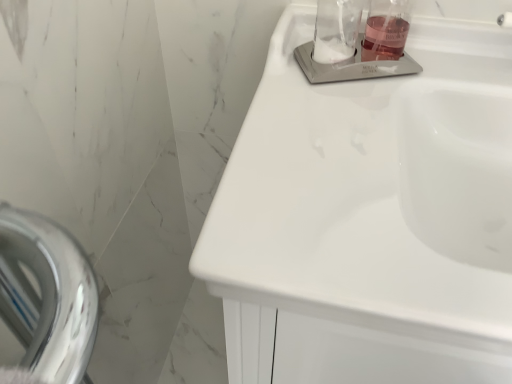
What do you see at coordinates (336, 30) in the screenshot? I see `clear glass jar at upper center` at bounding box center [336, 30].

Find the location of a particular element. clear glass soap dispenser at upper right, positioned as the second sink in front-to-back order is located at coordinates (352, 65).

Consider the image. From the image's perspective, who appears lower, translucent glass liquid at upper right or white glossy sink at upper right, acting as the 1th sink starting from the front?

From the image's view, white glossy sink at upper right, acting as the 1th sink starting from the front, is below.

Is translucent glass liquid at upper right to the left of white glossy sink at upper right, which is counted as the second sink, starting from the back, from the viewer's perspective?

Correct, you'll find translucent glass liquid at upper right to the left of white glossy sink at upper right, which is counted as the second sink, starting from the back.

Does point (399, 50) lie in front of point (401, 83)?

No.

Would you say translucent glass liquid at upper right is inside or outside white glossy sink at upper right, which is counted as the second sink, starting from the back?

translucent glass liquid at upper right exists outside the volume of white glossy sink at upper right, which is counted as the second sink, starting from the back.

Is translucent glass liquid at upper right surrounded by clear glass soap dispenser at upper right, which is the first sink in back-to-front order?

That's incorrect, translucent glass liquid at upper right is not inside clear glass soap dispenser at upper right, which is the first sink in back-to-front order.

Could you measure the distance between clear glass soap dispenser at upper right, the first sink in the top-to-bottom sequence, and translucent glass liquid at upper right?

clear glass soap dispenser at upper right, the first sink in the top-to-bottom sequence, is 2.35 inches away from translucent glass liquid at upper right.

From the image's perspective, starting from the translucent glass liquid at upper right, which sink is the 1st one below? Please provide its 2D coordinates.

[(352, 65)]

Which object is positioned more to the left, clear glass soap dispenser at upper right, the first sink in the top-to-bottom sequence, or translucent glass liquid at upper right?

clear glass soap dispenser at upper right, the first sink in the top-to-bottom sequence.

Does white glossy sink at upper right, marked as the second sink in a top-to-bottom arrangement, touch clear glass soap dispenser at upper right, which is the first sink in back-to-front order?

No, white glossy sink at upper right, marked as the second sink in a top-to-bottom arrangement, is not making contact with clear glass soap dispenser at upper right, which is the first sink in back-to-front order.

Is white glossy sink at upper right, acting as the 1th sink starting from the front, positioned with its back to clear glass soap dispenser at upper right, positioned as the second sink in front-to-back order?

white glossy sink at upper right, acting as the 1th sink starting from the front, does not have its back to clear glass soap dispenser at upper right, positioned as the second sink in front-to-back order.

Does white glossy sink at upper right, the 1th sink when ordered from bottom to top, lie behind clear glass soap dispenser at upper right, the first sink in the top-to-bottom sequence?

That is False.

Is white glossy sink at upper right, the 1th sink when ordered from bottom to top, inside or outside of clear glass soap dispenser at upper right, the first sink in the top-to-bottom sequence?

white glossy sink at upper right, the 1th sink when ordered from bottom to top, is spatially situated outside clear glass soap dispenser at upper right, the first sink in the top-to-bottom sequence.

How different are the orientations of white glossy sink at upper right, the 1th sink when ordered from bottom to top, and translucent glass liquid at upper right in degrees?

The angle between the facing direction of white glossy sink at upper right, the 1th sink when ordered from bottom to top, and the facing direction of translucent glass liquid at upper right is 24 degrees.

Is translucent glass liquid at upper right completely or partially inside white glossy sink at upper right, acting as the 1th sink starting from the front?

No.

Does point (474, 204) come closer to viewer compared to point (387, 45)?

Yes, point (474, 204) is in front of point (387, 45).

From the picture: Which object is closer to the camera, white glossy sink at upper right, acting as the 1th sink starting from the front, or translucent glass liquid at upper right?

white glossy sink at upper right, acting as the 1th sink starting from the front, is closer to the camera.

How different are the orientations of clear glass jar at upper center and clear glass soap dispenser at upper right, the first sink in the top-to-bottom sequence, in degrees?

0.002 degrees separate the facing orientations of clear glass jar at upper center and clear glass soap dispenser at upper right, the first sink in the top-to-bottom sequence.

Who is more distant, clear glass jar at upper center or clear glass soap dispenser at upper right, which is the first sink in back-to-front order?

clear glass soap dispenser at upper right, which is the first sink in back-to-front order, is further away from the camera.

Is clear glass jar at upper center to the left of clear glass soap dispenser at upper right, the first sink in the top-to-bottom sequence, from the viewer's perspective?

Indeed, clear glass jar at upper center is positioned on the left side of clear glass soap dispenser at upper right, the first sink in the top-to-bottom sequence.

From the image's perspective, relative to clear glass soap dispenser at upper right, positioned as the second sink in front-to-back order, is clear glass jar at upper center above or below?

Based on their image positions, clear glass jar at upper center is located above clear glass soap dispenser at upper right, positioned as the second sink in front-to-back order.

From the image's perspective, which is above, translucent glass liquid at upper right or clear glass soap dispenser at upper right, the first sink in the top-to-bottom sequence?

translucent glass liquid at upper right.

Does translucent glass liquid at upper right turn towards clear glass soap dispenser at upper right, the 2th sink ordered from the bottom?

No, translucent glass liquid at upper right is not facing towards clear glass soap dispenser at upper right, the 2th sink ordered from the bottom.

In the scene shown: Could you measure the distance between translucent glass liquid at upper right and clear glass soap dispenser at upper right, positioned as the second sink in front-to-back order?

translucent glass liquid at upper right is 2.35 inches away from clear glass soap dispenser at upper right, positioned as the second sink in front-to-back order.

Considering the relative sizes of translucent glass liquid at upper right and clear glass soap dispenser at upper right, the 2th sink ordered from the bottom, in the image provided, is translucent glass liquid at upper right bigger than clear glass soap dispenser at upper right, the 2th sink ordered from the bottom,?

No, translucent glass liquid at upper right is not bigger than clear glass soap dispenser at upper right, the 2th sink ordered from the bottom.

From the image's perspective, is clear glass soap dispenser at upper right, the first sink in the top-to-bottom sequence, positioned above or below clear glass jar at upper center?

clear glass soap dispenser at upper right, the first sink in the top-to-bottom sequence, is situated lower than clear glass jar at upper center in the image.

Is point (357, 59) closer or farther from the camera than point (341, 8)?

Point (357, 59) appears to be farther away from the viewer than point (341, 8).

Does clear glass soap dispenser at upper right, positioned as the second sink in front-to-back order, turn towards clear glass jar at upper center?

No, clear glass soap dispenser at upper right, positioned as the second sink in front-to-back order, is not facing towards clear glass jar at upper center.

How different are the orientations of clear glass soap dispenser at upper right, positioned as the second sink in front-to-back order, and clear glass jar at upper center in degrees?

0.002 degrees separate the facing orientations of clear glass soap dispenser at upper right, positioned as the second sink in front-to-back order, and clear glass jar at upper center.

Find the location of a particular element. liquid on the left of white glossy sink at upper right, acting as the 1th sink starting from the front is located at coordinates (384, 38).

At what (x,y) coordinates should I click in order to perform the action: click on liquid on the right of clear glass soap dispenser at upper right, the first sink in the top-to-bottom sequence. Please return your answer as a coordinate pair (x, y). The width and height of the screenshot is (512, 384). Looking at the image, I should click on (384, 38).

When comparing their distances from white glossy sink at upper right, acting as the 1th sink starting from the front, does clear glass soap dispenser at upper right, the first sink in the top-to-bottom sequence, or clear glass jar at upper center seem closer?

clear glass soap dispenser at upper right, the first sink in the top-to-bottom sequence, is closer to white glossy sink at upper right, acting as the 1th sink starting from the front.

Considering their positions, is clear glass soap dispenser at upper right, positioned as the second sink in front-to-back order, positioned further to clear glass jar at upper center than white glossy sink at upper right, the 1th sink when ordered from bottom to top?

The object further to clear glass jar at upper center is white glossy sink at upper right, the 1th sink when ordered from bottom to top.

Which object lies nearer to the anchor point clear glass jar at upper center, white glossy sink at upper right, the 1th sink when ordered from bottom to top, or translucent glass liquid at upper right?

translucent glass liquid at upper right lies closer to clear glass jar at upper center than the other object.

Estimate the real-world distances between objects in this image. Which object is closer to white glossy sink at upper right, marked as the second sink in a top-to-bottom arrangement, translucent glass liquid at upper right or clear glass jar at upper center?

clear glass jar at upper center is positioned closer to the anchor white glossy sink at upper right, marked as the second sink in a top-to-bottom arrangement.

Estimate the real-world distances between objects in this image. Which object is further from clear glass soap dispenser at upper right, positioned as the second sink in front-to-back order, white glossy sink at upper right, which is counted as the second sink, starting from the back, or translucent glass liquid at upper right?

Among the two, white glossy sink at upper right, which is counted as the second sink, starting from the back, is located further to clear glass soap dispenser at upper right, positioned as the second sink in front-to-back order.

In the scene shown: Estimate the real-world distances between objects in this image. Which object is closer to clear glass soap dispenser at upper right, which is the first sink in back-to-front order, white glossy sink at upper right, acting as the 1th sink starting from the front, or clear glass jar at upper center?

clear glass jar at upper center.

When comparing their distances from clear glass jar at upper center, does white glossy sink at upper right, marked as the second sink in a top-to-bottom arrangement, or clear glass soap dispenser at upper right, the 2th sink ordered from the bottom, seem closer?

clear glass soap dispenser at upper right, the 2th sink ordered from the bottom, is positioned closer to the anchor clear glass jar at upper center.

Looking at the image, which one is located further to clear glass soap dispenser at upper right, positioned as the second sink in front-to-back order, clear glass jar at upper center or white glossy sink at upper right, the 1th sink when ordered from bottom to top?

white glossy sink at upper right, the 1th sink when ordered from bottom to top.

This screenshot has width=512, height=384. What are the coordinates of `liquid positioned between clear glass jar at upper center and clear glass soap dispenser at upper right, the 2th sink ordered from the bottom, from near to far` in the screenshot? It's located at (384, 38).

At what (x,y) coordinates should I click in order to perform the action: click on glass jar between translucent glass liquid at upper right and white glossy sink at upper right, marked as the second sink in a top-to-bottom arrangement, vertically. Please return your answer as a coordinate pair (x, y). Image resolution: width=512 pixels, height=384 pixels. Looking at the image, I should click on (336, 30).

The width and height of the screenshot is (512, 384). I want to click on sink between translucent glass liquid at upper right and white glossy sink at upper right, the 1th sink when ordered from bottom to top, from top to bottom, so click(352, 65).

What are the coordinates of `sink between clear glass jar at upper center and white glossy sink at upper right, the 1th sink when ordered from bottom to top, in the vertical direction` in the screenshot? It's located at (x=352, y=65).